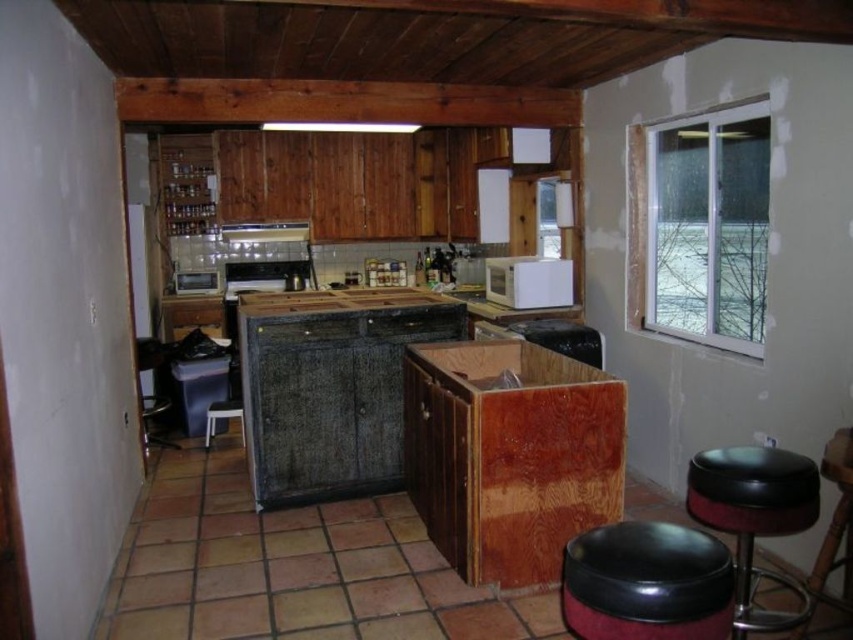
Which is above, wooden at center or metallic silver exhaust hood at upper center?

Positioned higher is metallic silver exhaust hood at upper center.

Can you confirm if wooden at center is positioned to the right of metallic silver exhaust hood at upper center?

Yes, wooden at center is to the right of metallic silver exhaust hood at upper center.

Where is `wooden at center`? wooden at center is located at coordinates (339, 298).

You are a GUI agent. You are given a task and a screenshot of the screen. Output one action in this format:
    pyautogui.click(x=<x>, y=<y>)
    Task: Click on the wooden at center
    
    Given the screenshot: What is the action you would take?
    pyautogui.click(x=339, y=298)

Is black leather stool at lower right below matte black toaster oven at left?

Correct, black leather stool at lower right is located below matte black toaster oven at left.

Who is more distant from viewer, (642, 627) or (212, 288)?

The point (212, 288) is behind.

Image resolution: width=853 pixels, height=640 pixels. Describe the element at coordinates (646, 582) in the screenshot. I see `black leather stool at lower right` at that location.

The image size is (853, 640). In order to click on black leather stool at lower right in this screenshot , I will do `click(646, 582)`.

Who is positioned more to the right, metallic silver exhaust hood at upper center or white plastic stool at center?

metallic silver exhaust hood at upper center

Who is more forward, (273, 230) or (218, 403)?

Positioned in front is point (218, 403).

Locate an element on the screen. metallic silver exhaust hood at upper center is located at coordinates (265, 230).